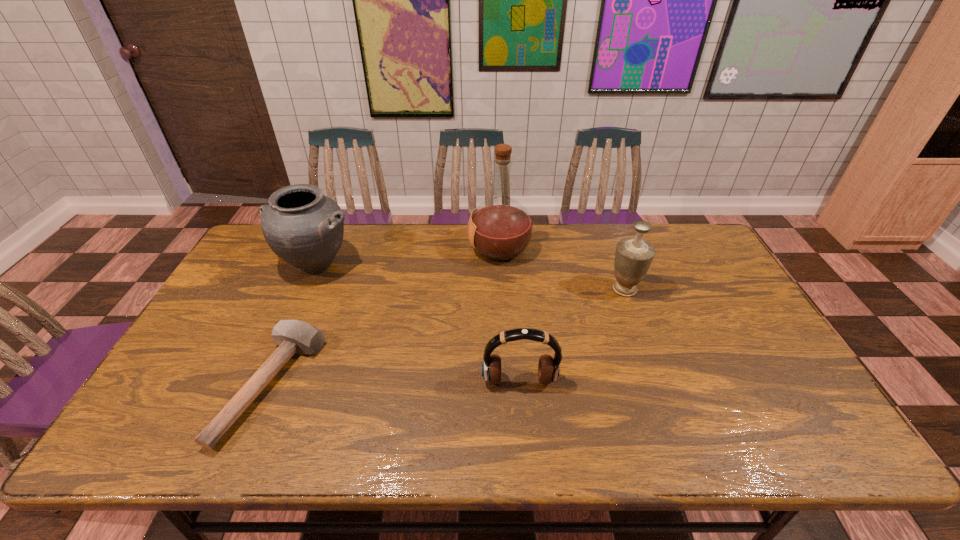
Find the location of a particular element. The image size is (960, 540). vacant region at the right edge is located at coordinates (718, 345).

This screenshot has height=540, width=960. Find the location of `vacant space that's between the rightmost object and the liquor`. vacant space that's between the rightmost object and the liquor is located at coordinates (562, 269).

Image resolution: width=960 pixels, height=540 pixels. Find the location of `vacant point located between the liquor and the rightmost object`. vacant point located between the liquor and the rightmost object is located at coordinates (562, 269).

What are the coordinates of `unoccupied area between the rightmost object and the left urn` in the screenshot? It's located at (470, 277).

The height and width of the screenshot is (540, 960). In order to click on unoccupied area between the tallest object and the left urn in this screenshot , I will do `click(408, 257)`.

Find the location of a particular element. This screenshot has width=960, height=540. free space between the headset and the tallest object is located at coordinates (510, 315).

The width and height of the screenshot is (960, 540). I want to click on free space between the tallest object and the right urn, so click(x=562, y=269).

At what (x,y) coordinates should I click in order to perform the action: click on free space between the mallet and the right urn. Please return your answer as a coordinate pair (x, y). Image resolution: width=960 pixels, height=540 pixels. Looking at the image, I should click on (448, 337).

Where is `vacant region between the shortest object and the tallest object`? Image resolution: width=960 pixels, height=540 pixels. vacant region between the shortest object and the tallest object is located at coordinates (386, 317).

Where is `free space between the rightmost object and the left urn`? This screenshot has height=540, width=960. free space between the rightmost object and the left urn is located at coordinates (470, 277).